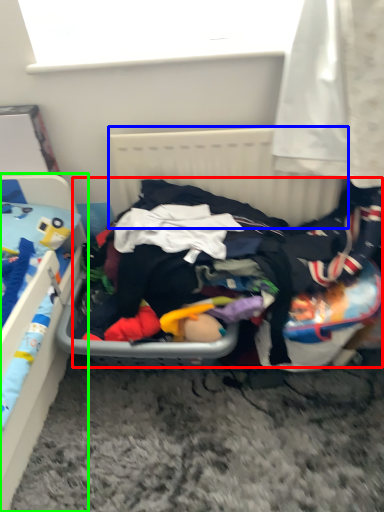
Question: Based on their relative distances, which object is farther from clothing (highlighted by a red box)? Choose from radiator (highlighted by a blue box) and furniture (highlighted by a green box).

Choices:
 (A) radiator
 (B) furniture

Answer: (B)